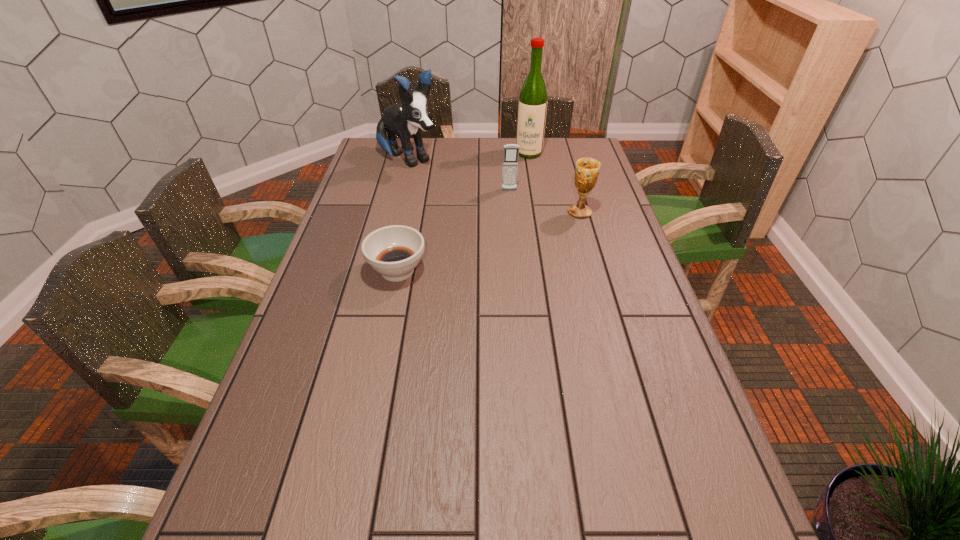
Find the location of `puppy situated at the far edge`. puppy situated at the far edge is located at coordinates (406, 119).

Find the location of `soup bowl that is at the left edge`. soup bowl that is at the left edge is located at coordinates (394, 251).

I want to click on puppy located in the left edge section of the desktop, so click(406, 119).

Where is `object that is at the right edge`? The image size is (960, 540). object that is at the right edge is located at coordinates (587, 169).

The height and width of the screenshot is (540, 960). I want to click on object present at the far left corner, so click(406, 119).

Where is `free space at the far edge`? free space at the far edge is located at coordinates (447, 137).

What are the coordinates of `vacant space at the near edge` in the screenshot? It's located at (320, 484).

Find the location of a particular element. The width and height of the screenshot is (960, 540). vacant area at the left edge is located at coordinates (329, 240).

The image size is (960, 540). I want to click on vacant space at the right edge, so click(611, 208).

Where is `vacant space at the near left corner of the desktop`? The image size is (960, 540). vacant space at the near left corner of the desktop is located at coordinates (314, 463).